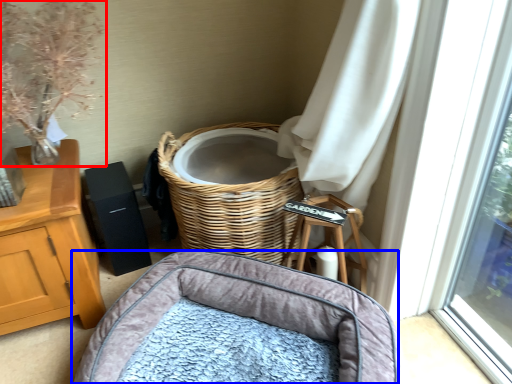
Question: Which point is closer to the camera, floral arrangement (highlighted by a red box) or infant bed (highlighted by a blue box)?

Choices:
 (A) floral arrangement
 (B) infant bed

Answer: (B)